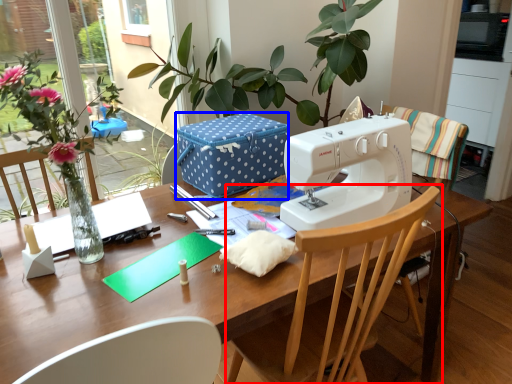
Question: Which of the following is the closest to the observer, chair (highlighted by a red box) or cardboard box (highlighted by a blue box)?

Choices:
 (A) chair
 (B) cardboard box

Answer: (A)